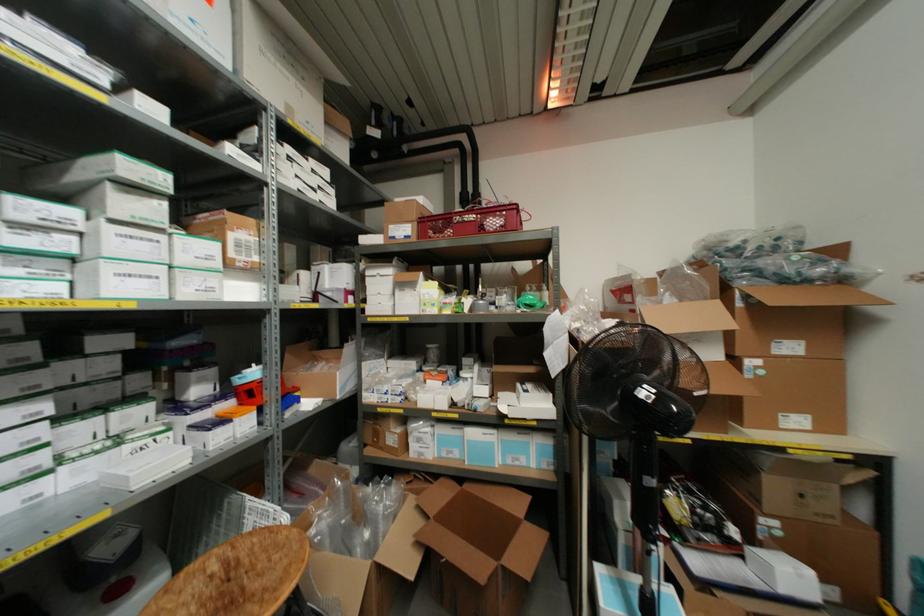
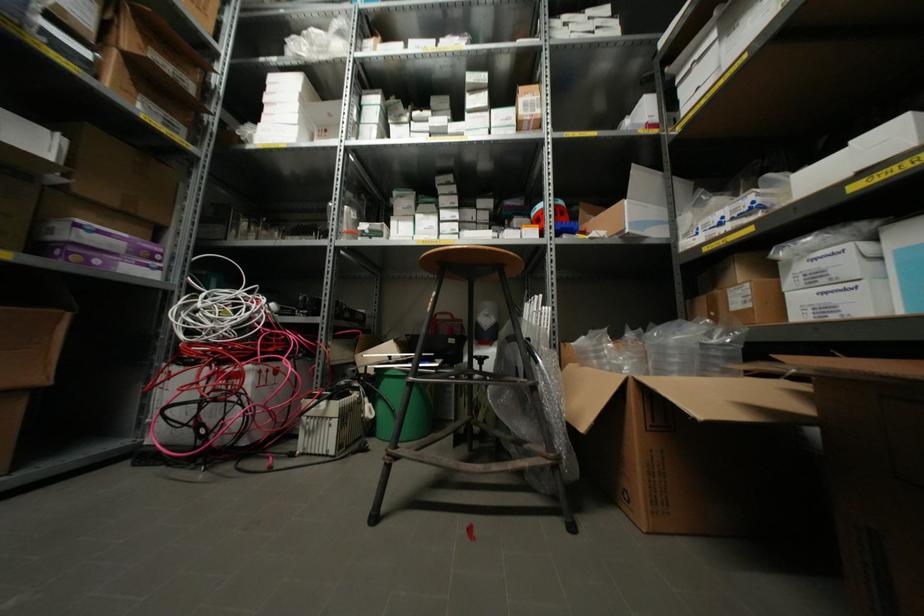
In the second image, find the point that corresponds to pixel 407 318 in the first image.

(743, 55)